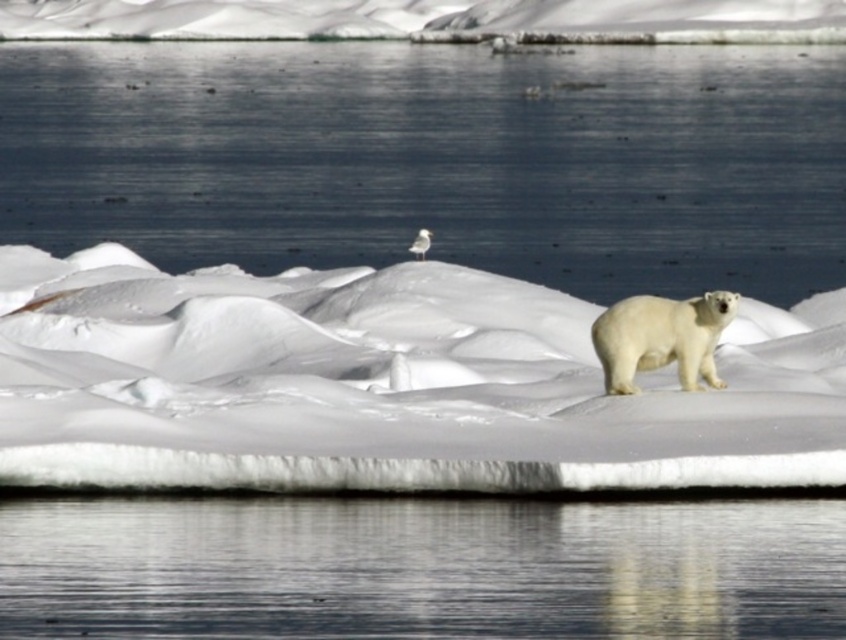
You are a wildlife photographer trying to capture the polar bear in the image. You notice the white fluffy snow at upper center and the white fur polar bear at right. Which one takes up more space in the photo?

The white fluffy snow at upper center takes up more space in the photo than the white fur polar bear at right because it is bigger.

You are an Arctic explorer trying to cross the ice floe. You notice two areas of white fluffy snow at center and white fluffy snow at upper center. Which area would you choose to walk on if you want to avoid sinking into the snow? Explain your choice based on their widths.

You should choose the white fluffy snow at upper center because it has a greater width than the white fluffy snow at center, indicating it might be more stable or compacted. However, in reality, snow stability can depend on factors like depth and underlying ice conditions, which aren